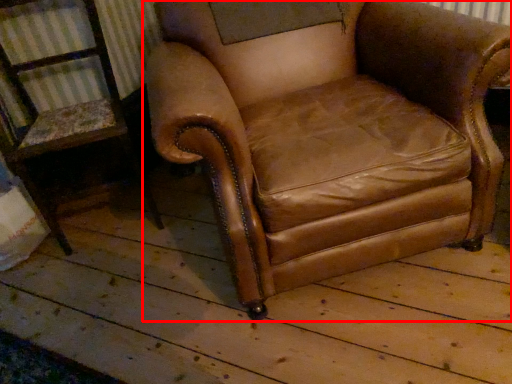
Question: Where is chair (annotated by the red box) located in relation to chair in the image?

Choices:
 (A) left
 (B) right

Answer: (B)